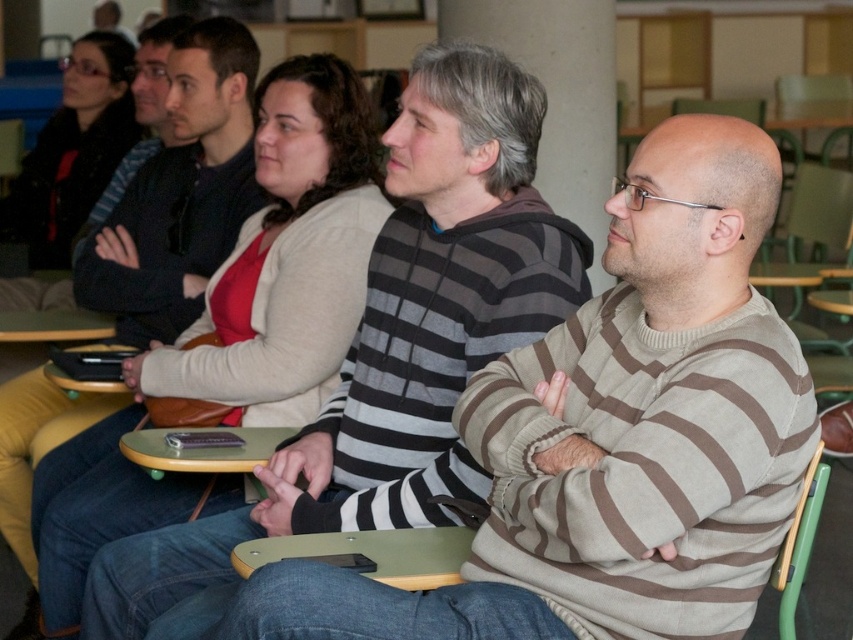
You are an interior designer assessing the layout of this classroom. You notice the matte beige sweater at center and the matte black jacket at upper left. Which object appears taller in the image?

The matte beige sweater at center appears taller than the matte black jacket at upper left according to the description.

You are organizing a clothing donation drive and need to categorize the striped sweater at center and the matte beige sweater at center based on their sizes. Which sweater should be placed in the large size bin?

The striped sweater at center should be placed in the large size bin because its width is larger than the matte beige sweater at center.